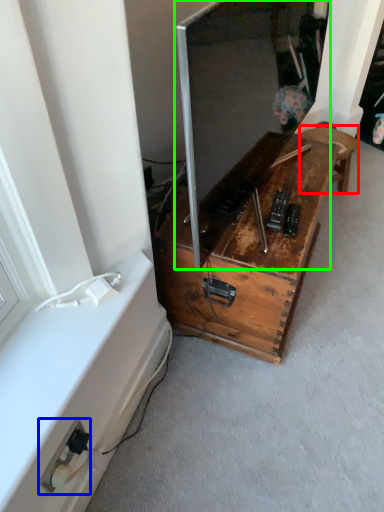
Question: Estimate the real-world distances between objects in this image. Which object is farther from furniture (highlighted by a red box), electric outlet (highlighted by a blue box) or window screen (highlighted by a green box)?

Choices:
 (A) electric outlet
 (B) window screen

Answer: (A)